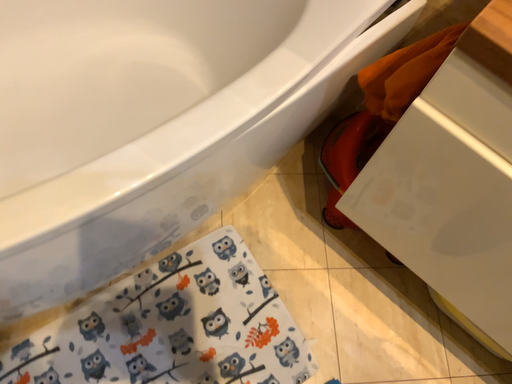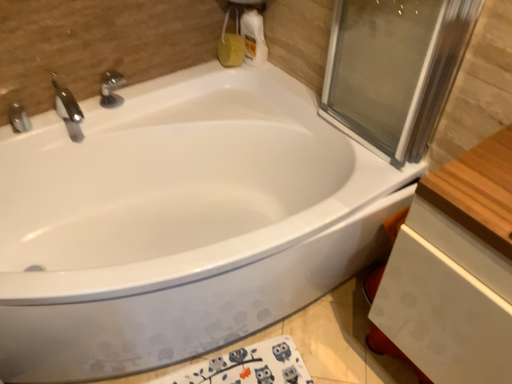
Question: How did the camera likely rotate when shooting the video?

Choices:
 (A) rotated right
 (B) rotated left

Answer: (B)